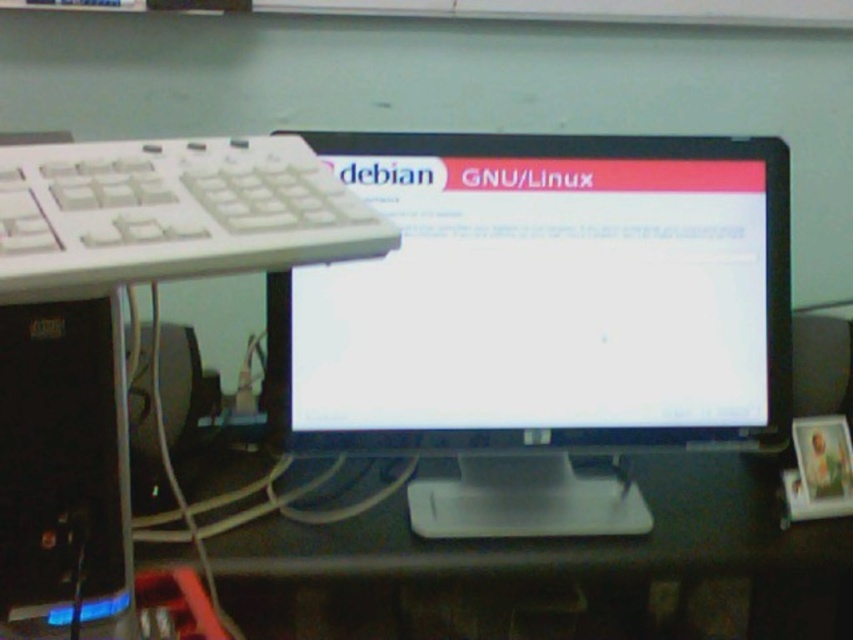
Can you confirm if white plastic keyboard at left is positioned above black plastic desktop computer at left?

Correct, white plastic keyboard at left is located above black plastic desktop computer at left.

Which is below, white plastic keyboard at left or black plastic desktop computer at left?

black plastic desktop computer at left

Does point (16, 205) lie behind point (67, 476)?

No, (16, 205) is closer to viewer.

You are a GUI agent. You are given a task and a screenshot of the screen. Output one action in this format:
    pyautogui.click(x=<x>, y=<y>)
    Task: Click on the white plastic keyboard at left
    
    Given the screenshot: What is the action you would take?
    pyautogui.click(x=171, y=212)